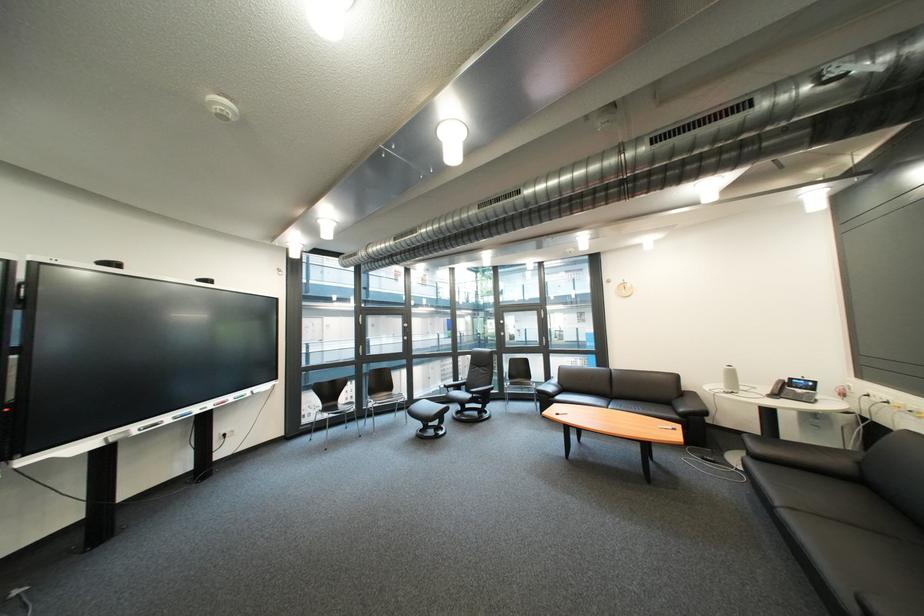
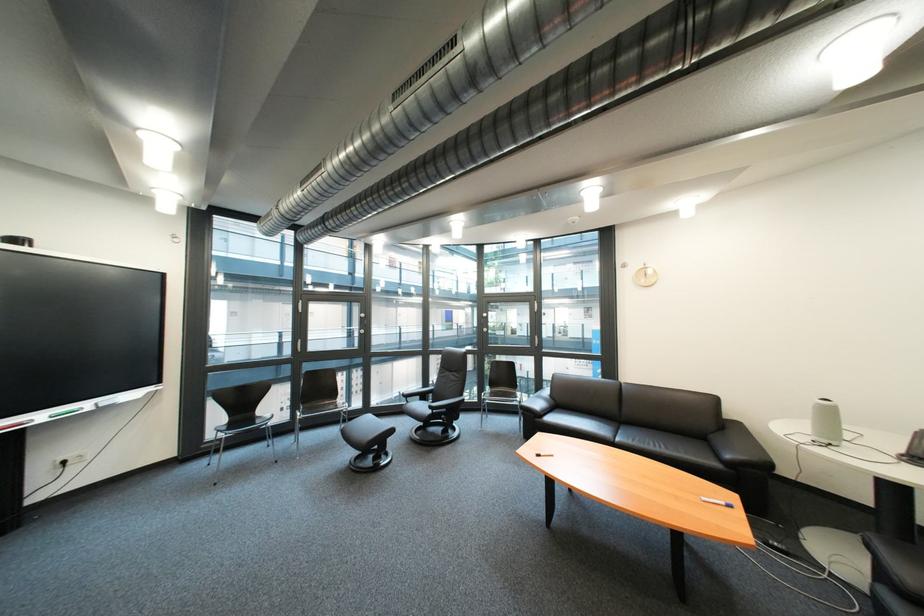
Where in the second image is the point corresponding to point 739,370 from the first image?

(833, 406)